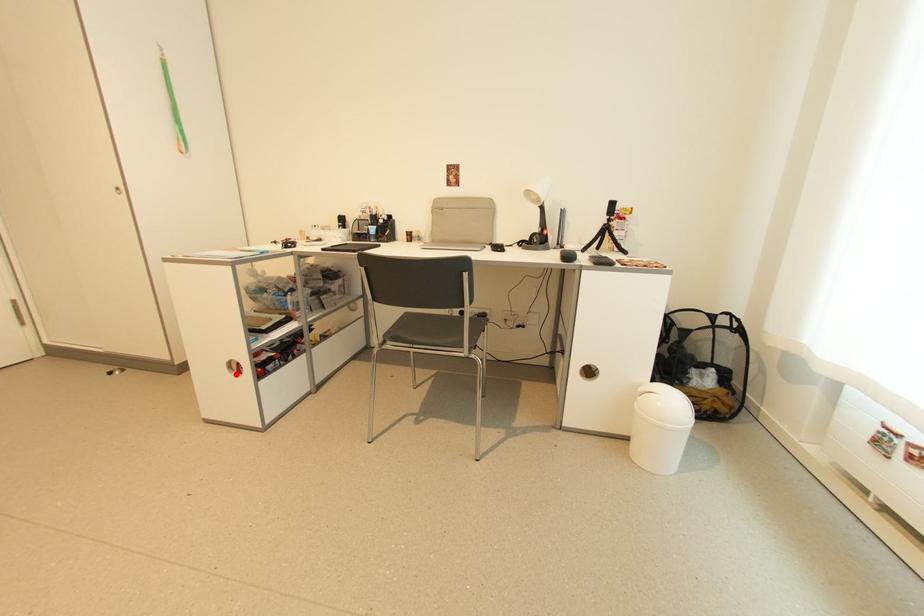
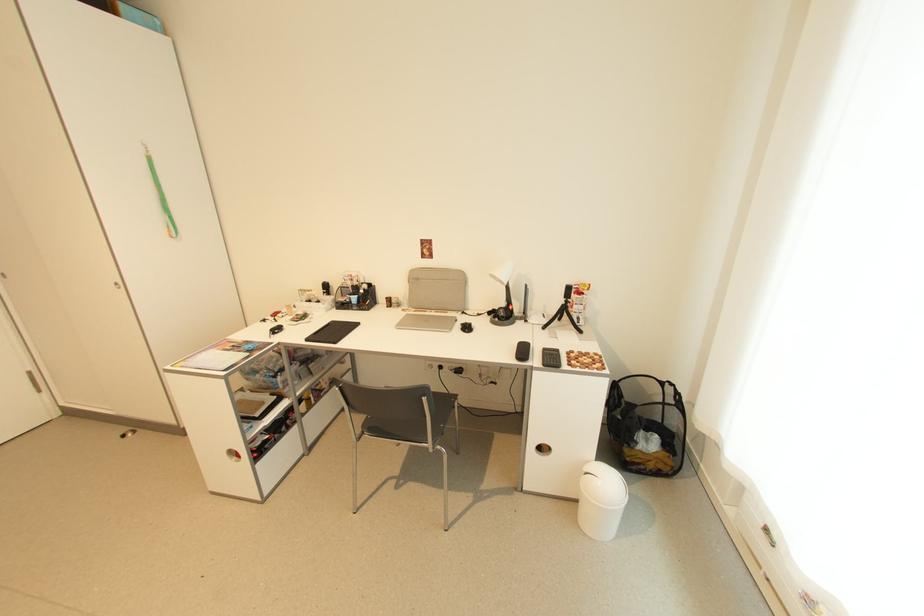
Question: I am providing you with two images of the same scene from different viewpoints. Image1 has a red point marked. In image2, the corresponding 3D location appears at what relative position? Reply with the corresponding letter.

Choices:
 (A) Closer
 (B) Farther

Answer: (B)